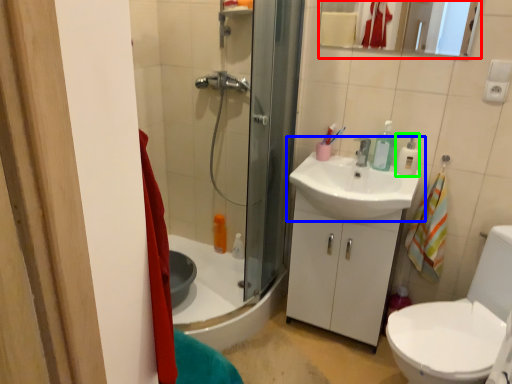
Question: Considering the real-world distances, which object is farthest from mirror (highlighted by a red box)? sink (highlighted by a blue box) or soap dispenser (highlighted by a green box)?

Choices:
 (A) sink
 (B) soap dispenser

Answer: (A)